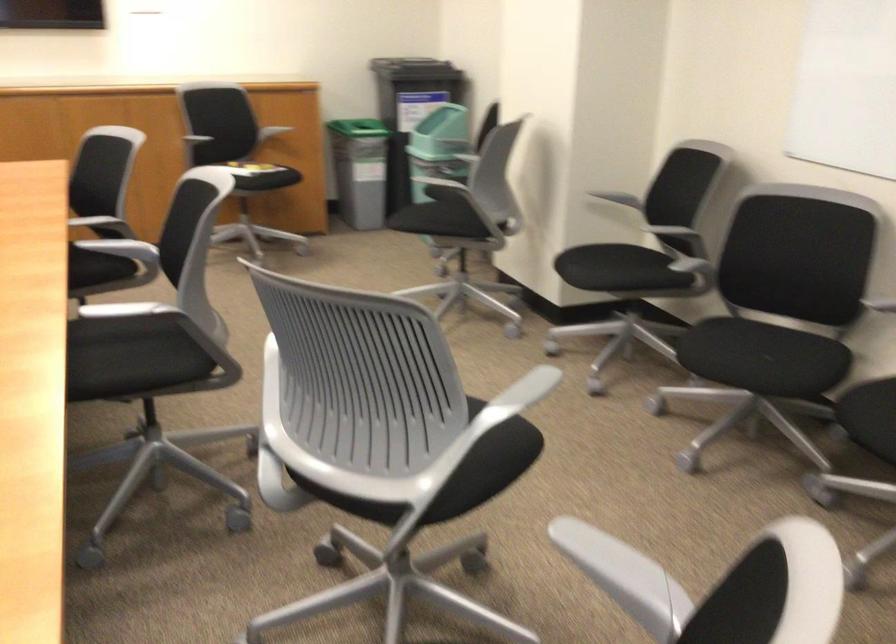
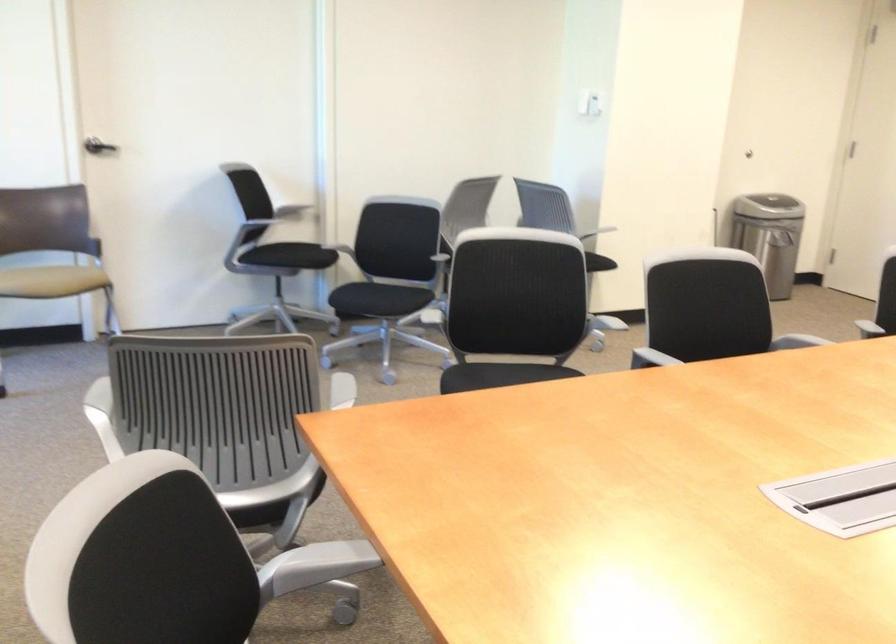
Question: Based on the continuous images, in which direction is the camera rotating? Reply with the corresponding letter.

Choices:
 (A) Left
 (B) Right
 (C) Up
 (D) Down

Answer: (A)